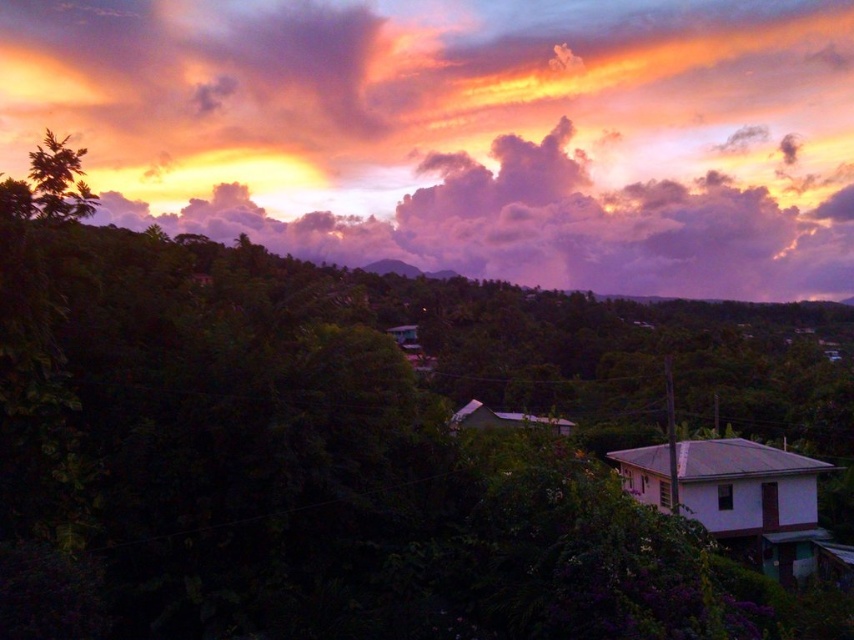
You are an artist trying to paint the sunset scene. You notice the purple cotton candy cloud at upper center and the green leafy tree at upper left. Which object should you paint first if you want to follow the principle of painting larger objects before smaller ones?

The purple cotton candy cloud at upper center should be painted first because it is taller than the green leafy tree at upper left, making it larger in size.

You are standing in the sunset scene and want to walk from the point at coordinates point (186, 84) to the point at coordinates point (44, 188). Which direction should you move to get closer to your destination?

Since point (186, 84) is further to the camera than point (44, 188), you should move forward towards the horizon to get closer to your destination.

Looking at this image, you are an artist painting this sunset scene. You want to ensure the purple cotton candy cloud at upper center and the green leafy tree at upper left are proportionally accurate. Which object should you make wider in your painting?

The purple cotton candy cloud at upper center should be made wider since its width surpasses that of the green leafy tree at upper left.